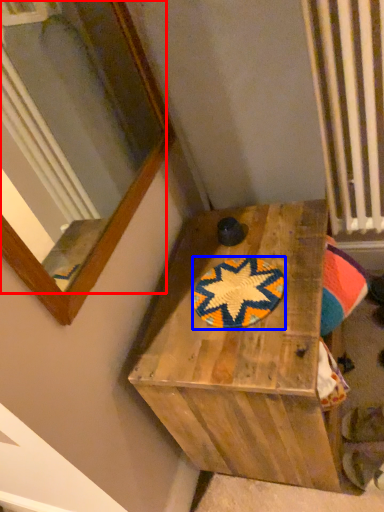
Question: Which of the following is the closest to the observer, mirror (highlighted by a red box) or mat (highlighted by a blue box)?

Choices:
 (A) mirror
 (B) mat

Answer: (A)